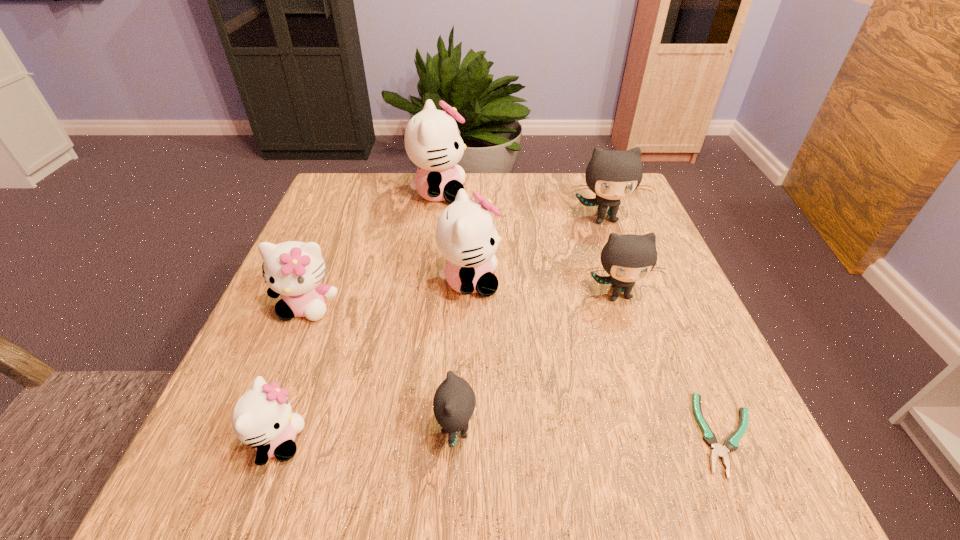
Locate an element on the screen. This screenshot has height=540, width=960. the tallest object is located at coordinates (432, 139).

I want to click on the biggest white kitten, so click(432, 139).

Locate an element on the screen. the second biggest white kitten is located at coordinates (465, 234).

This screenshot has width=960, height=540. Identify the location of the farthest gray kitten. click(x=612, y=175).

The image size is (960, 540). I want to click on the second smallest white kitten, so click(294, 269).

Find the location of a particular element. the second smallest gray kitten is located at coordinates (627, 258).

Where is `the nearest white kitten`? The height and width of the screenshot is (540, 960). the nearest white kitten is located at coordinates (262, 417).

Where is `the smallest gray kitten`? This screenshot has width=960, height=540. the smallest gray kitten is located at coordinates (454, 402).

Image resolution: width=960 pixels, height=540 pixels. Find the location of `the nearest gray kitten`. the nearest gray kitten is located at coordinates (454, 402).

Identify the location of pliers. The height and width of the screenshot is (540, 960). (731, 443).